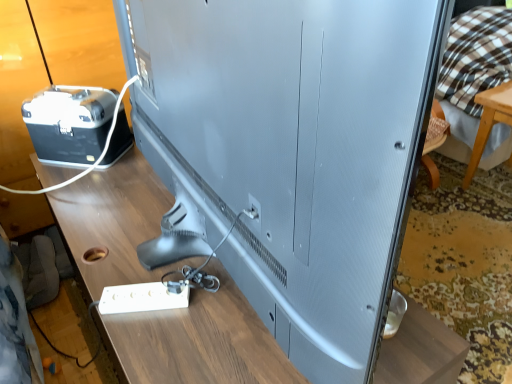
You are a GUI agent. You are given a task and a screenshot of the screen. Output one action in this format:
    pyautogui.click(x=<x>, y=<y>)
    Task: Click on the free space in front of white plastic wire at left
    Image resolution: width=512 pixels, height=384 pixels.
    Given the screenshot: What is the action you would take?
    pyautogui.click(x=93, y=186)